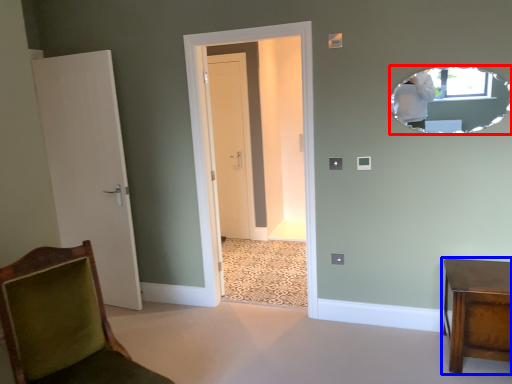
Question: Which object is further to the camera taking this photo, mirror (highlighted by a red box) or furniture (highlighted by a blue box)?

Choices:
 (A) mirror
 (B) furniture

Answer: (A)